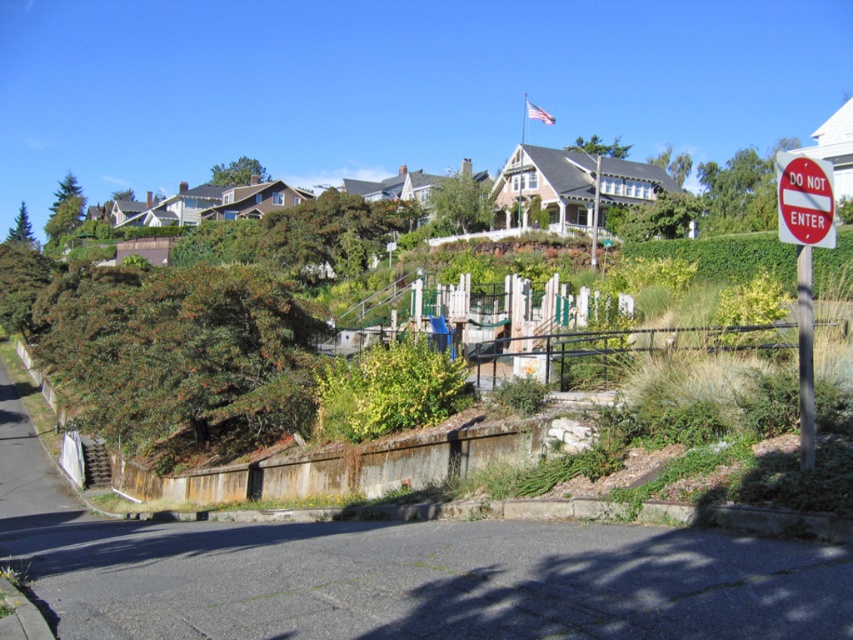
Question: Observing the image, what is the correct spatial positioning of red plastic sign at right in reference to white plastic signpost at right?

Choices:
 (A) above
 (B) below

Answer: (A)

Question: Can you confirm if red plastic sign at right is positioned to the right of white plastic signpost at right?

Choices:
 (A) yes
 (B) no

Answer: (B)

Question: Does red plastic sign at right have a larger size compared to white plastic signpost at right?

Choices:
 (A) no
 (B) yes

Answer: (B)

Question: Which object appears farthest from the camera in this image?

Choices:
 (A) white plastic signpost at right
 (B) red plastic sign at right

Answer: (A)

Question: Among these points, which one is nearest to the camera?

Choices:
 (A) (810, 444)
 (B) (782, 160)

Answer: (A)